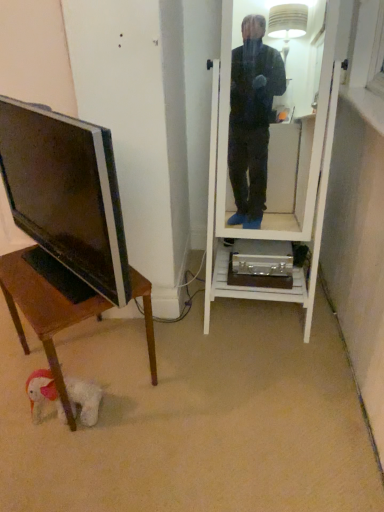
This screenshot has width=384, height=512. Describe the element at coordinates (66, 193) in the screenshot. I see `matte black tv at left` at that location.

Describe the element at coordinates (274, 144) in the screenshot. I see `white glossy mirror at center` at that location.

This screenshot has width=384, height=512. I want to click on matte black tv at left, so click(x=66, y=193).

Between matte black tv at left and wooden desk at lower left, which one has more height?

matte black tv at left is taller.

From the image's perspective, relative to wooden desk at lower left, is matte black tv at left above or below?

Clearly, from the image's perspective, matte black tv at left is above wooden desk at lower left.

From a real-world perspective, which object stands above the other?

From a 3D spatial view, matte black tv at left is above.

Considering the relative sizes of matte black tv at left and white glossy mirror at center in the image provided, is matte black tv at left shorter than white glossy mirror at center?

Indeed, matte black tv at left has a lesser height compared to white glossy mirror at center.

From the image's perspective, is matte black tv at left below white glossy mirror at center?

Correct, matte black tv at left appears lower than white glossy mirror at center in the image.

Visually, is matte black tv at left positioned to the left or to the right of white glossy mirror at center?

Clearly, matte black tv at left is on the left of white glossy mirror at center in the image.

Is wooden desk at lower left closer to the viewer compared to white glossy mirror at center?

No, it is behind white glossy mirror at center.

Which is closer to the camera, (131, 281) or (333, 74)?

The point (131, 281) is closer to the camera.

Does wooden desk at lower left have a larger size compared to white glossy mirror at center?

No, wooden desk at lower left is not bigger than white glossy mirror at center.

Identify the location of mirror lying behind the matte black tv at left. This screenshot has height=512, width=384. (274, 144).

Can you confirm if white glossy mirror at center is taller than matte black tv at left?

Indeed, white glossy mirror at center has a greater height compared to matte black tv at left.

From the picture: Considering the relative positions of white glossy mirror at center and matte black tv at left in the image provided, is white glossy mirror at center in front of matte black tv at left?

No, white glossy mirror at center is further to the viewer.

Could you tell me if white glossy mirror at center is facing matte black tv at left?

No, white glossy mirror at center is not facing towards matte black tv at left.

Is white glossy mirror at center further to the viewer compared to wooden desk at lower left?

No, white glossy mirror at center is closer to the camera.

Identify the location of mirror on the right of wooden desk at lower left. The height and width of the screenshot is (512, 384). (274, 144).

Who is taller, white glossy mirror at center or wooden desk at lower left?

white glossy mirror at center is taller.

Does wooden desk at lower left touch matte black tv at left?

No.

Considering the relative sizes of wooden desk at lower left and matte black tv at left in the image provided, is wooden desk at lower left wider than matte black tv at left?

Yes.

Who is smaller, wooden desk at lower left or matte black tv at left?

Smaller between the two is matte black tv at left.

You are a GUI agent. You are given a task and a screenshot of the screen. Output one action in this format:
    pyautogui.click(x=<x>, y=<y>)
    Task: Click on the desk on the right of matte black tv at left
    
    Given the screenshot: What is the action you would take?
    pyautogui.click(x=46, y=306)

The width and height of the screenshot is (384, 512). I want to click on mirror that appears above the matte black tv at left (from the image's perspective), so click(x=274, y=144).

Which object lies nearer to the anchor point white glossy mirror at center, matte black tv at left or wooden desk at lower left?

The object closer to white glossy mirror at center is wooden desk at lower left.

From the image, which object appears to be nearer to matte black tv at left, wooden desk at lower left or white glossy mirror at center?

Among the two, wooden desk at lower left is located nearer to matte black tv at left.

Which object lies nearer to the anchor point matte black tv at left, white glossy mirror at center or wooden desk at lower left?

wooden desk at lower left.

From the picture: Considering their positions, is white glossy mirror at center positioned further to wooden desk at lower left than matte black tv at left?

The object further to wooden desk at lower left is white glossy mirror at center.

Looking at the image, which one is located further to wooden desk at lower left, matte black tv at left or white glossy mirror at center?

white glossy mirror at center is positioned further to the anchor wooden desk at lower left.

Which object lies nearer to the anchor point white glossy mirror at center, wooden desk at lower left or matte black tv at left?

wooden desk at lower left is positioned closer to the anchor white glossy mirror at center.

At what (x,y) coordinates should I click in order to perform the action: click on desk situated between matte black tv at left and white glossy mirror at center from left to right. Please return your answer as a coordinate pair (x, y). Looking at the image, I should click on [x=46, y=306].